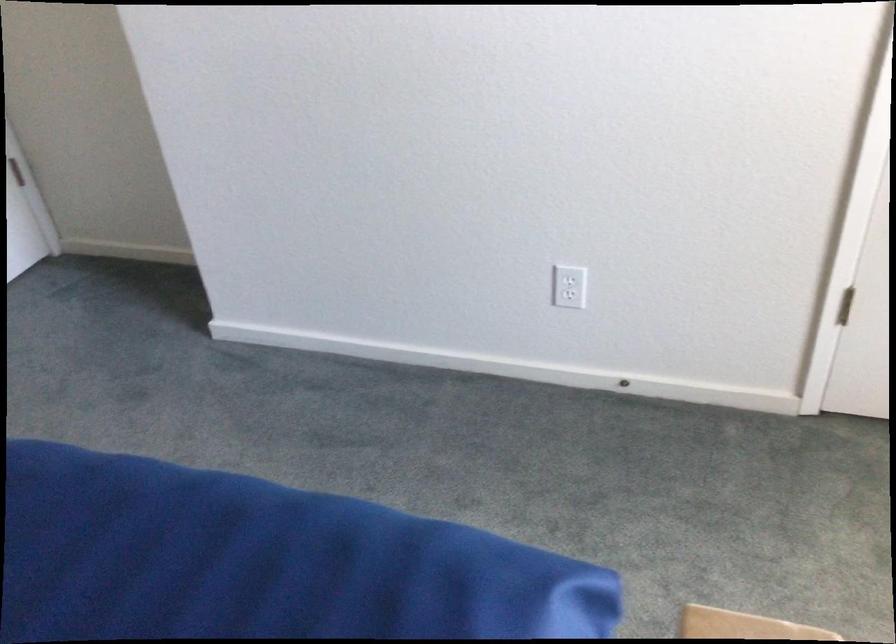
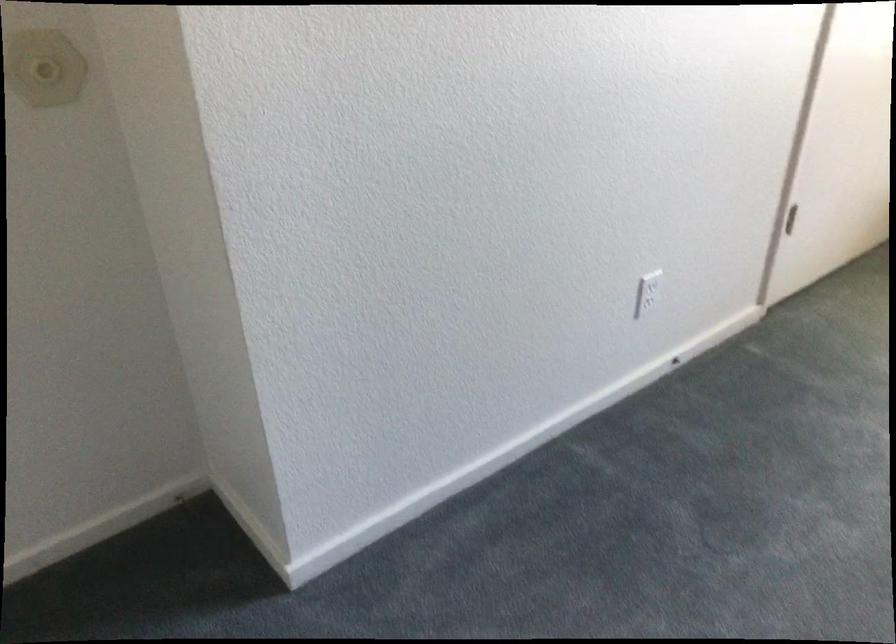
Where in the second image is the point corresponding to point 574,299 from the first image?

(645, 303)